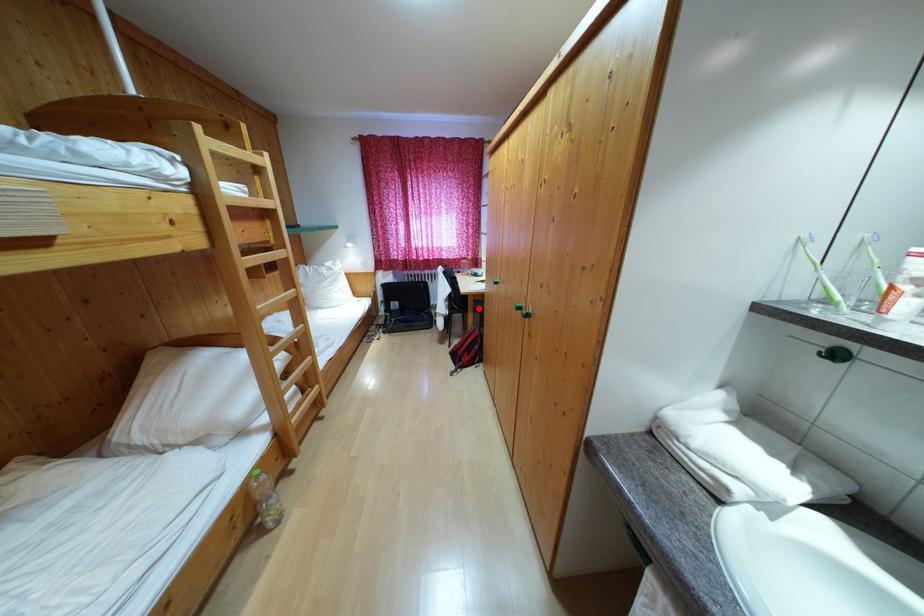
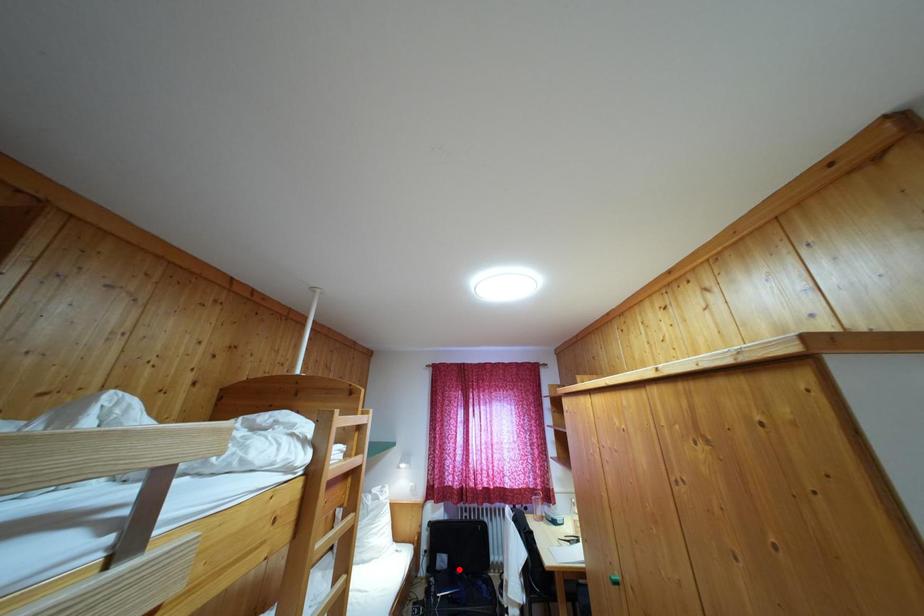
I am providing you with two images of the same scene from different viewpoints. A red point is marked on the first image and another point is marked on the second image. Do the highlighted points in image1 and image2 indicate the same real-world spot?

No